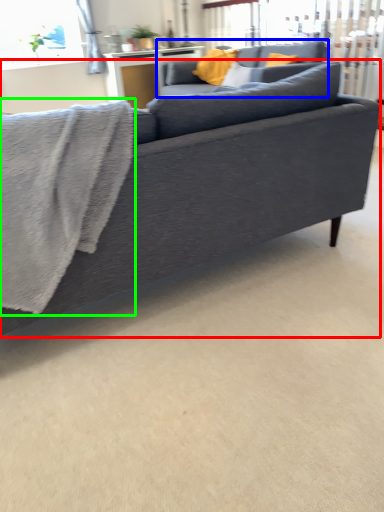
Question: Which object is the farthest from studio couch (highlighted by a red box)? Choose among these: studio couch (highlighted by a blue box) or bath towel (highlighted by a green box).

Choices:
 (A) studio couch
 (B) bath towel

Answer: (A)